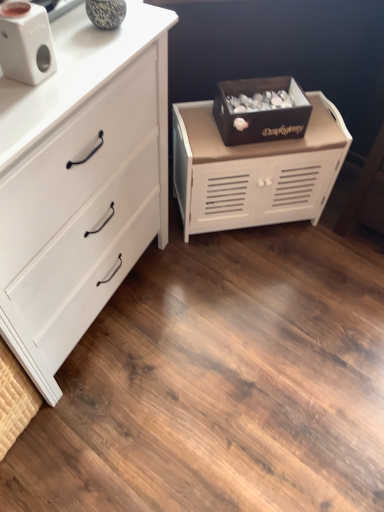
Question: Can you confirm if dark brown wooden box at center is shorter than white matte speaker at upper left?

Choices:
 (A) no
 (B) yes

Answer: (A)

Question: Considering the relative positions of dark brown wooden box at center and white matte speaker at upper left in the image provided, is dark brown wooden box at center to the left of white matte speaker at upper left from the viewer's perspective?

Choices:
 (A) yes
 (B) no

Answer: (B)

Question: Is dark brown wooden box at center positioned with its back to white matte speaker at upper left?

Choices:
 (A) no
 (B) yes

Answer: (A)

Question: Does dark brown wooden box at center lie behind white matte speaker at upper left?

Choices:
 (A) yes
 (B) no

Answer: (A)

Question: Does dark brown wooden box at center touch white matte speaker at upper left?

Choices:
 (A) no
 (B) yes

Answer: (A)

Question: From a real-world perspective, relative to white matte cabinet at center, which is the first chest of drawers from right to left, is dark brown wooden box at center vertically above or below?

Choices:
 (A) below
 (B) above

Answer: (B)

Question: Considering their positions, is dark brown wooden box at center located in front of or behind white matte cabinet at center, which is the first chest of drawers from right to left?

Choices:
 (A) behind
 (B) front

Answer: (B)

Question: Which is correct: dark brown wooden box at center is inside white matte cabinet at center, which is the first chest of drawers from right to left, or outside of it?

Choices:
 (A) outside
 (B) inside

Answer: (A)

Question: Considering the positions of dark brown wooden box at center and white matte cabinet at center, which is the first chest of drawers from right to left, in the image, is dark brown wooden box at center wider or thinner than white matte cabinet at center, which is the first chest of drawers from right to left,?

Choices:
 (A) wide
 (B) thin

Answer: (B)

Question: Considering their positions, is white matte chest of drawers at left, arranged as the second chest of drawers when viewed from the right, located in front of or behind white matte speaker at upper left?

Choices:
 (A) behind
 (B) front

Answer: (B)

Question: Is white matte chest of drawers at left, arranged as the second chest of drawers when viewed from the right, wider or thinner than white matte speaker at upper left?

Choices:
 (A) thin
 (B) wide

Answer: (B)

Question: Is point (77, 295) positioned closer to the camera than point (41, 53)?

Choices:
 (A) farther
 (B) closer

Answer: (A)

Question: From the image's perspective, is white matte chest of drawers at left, arranged as the second chest of drawers when viewed from the right, above or below white matte speaker at upper left?

Choices:
 (A) below
 (B) above

Answer: (A)

Question: In the image, is white matte chest of drawers at left, the first chest of drawers from the left, positioned in front of or behind white matte cabinet at center, the 2th chest of drawers from the left?

Choices:
 (A) front
 (B) behind

Answer: (A)

Question: From a real-world perspective, is white matte chest of drawers at left, arranged as the second chest of drawers when viewed from the right, positioned above or below white matte cabinet at center, the 2th chest of drawers from the left?

Choices:
 (A) above
 (B) below

Answer: (A)